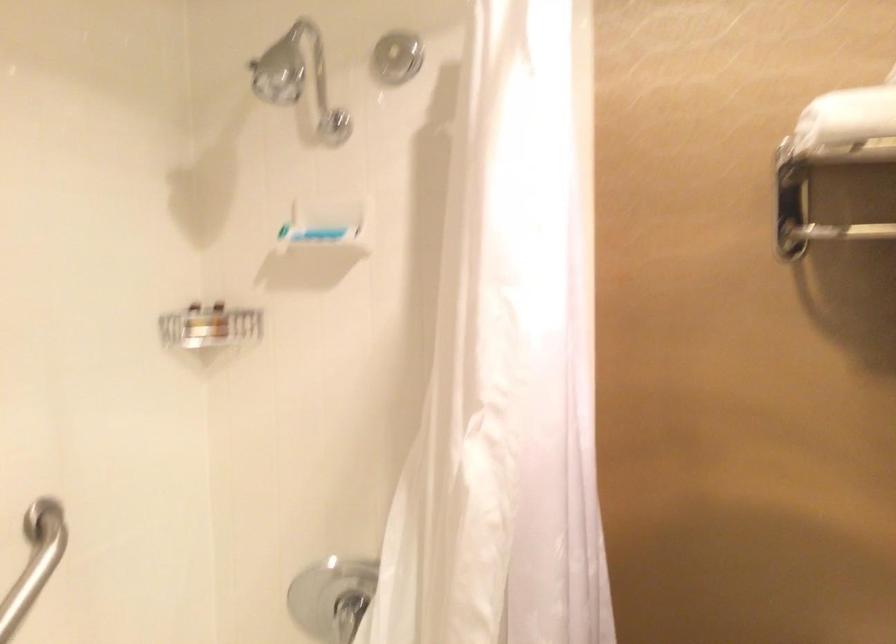
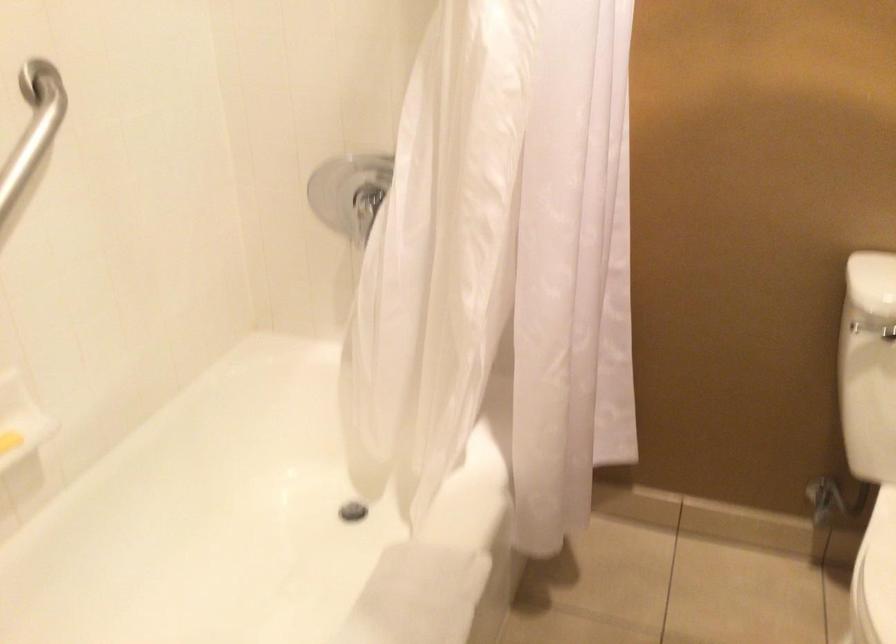
Question: Based on the continuous images, in which direction is the camera rotating? Reply with the corresponding letter.

Choices:
 (A) Left
 (B) Right
 (C) Up
 (D) Down

Answer: (D)